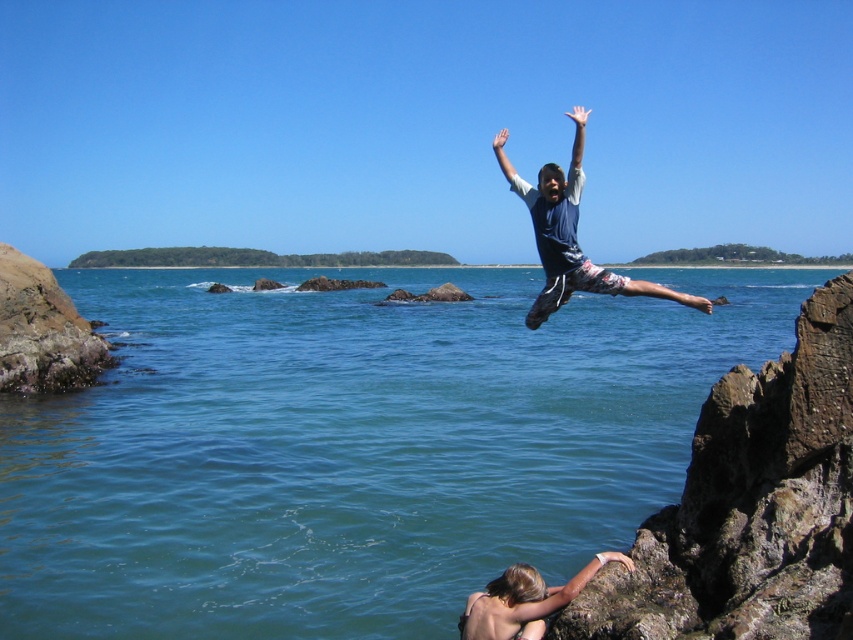
Question: Can you confirm if clear blue water at center is positioned above blue cotton shirt at upper center?

Choices:
 (A) yes
 (B) no

Answer: (B)

Question: Is clear blue water at center to the right of blue cotton shirt at upper center from the viewer's perspective?

Choices:
 (A) no
 (B) yes

Answer: (A)

Question: Which object is closer to the camera taking this photo?

Choices:
 (A) brown rough rock at right
 (B) clear blue water at center
 (C) blonde hair at lower right
 (D) blue cotton shirt at upper center

Answer: (A)

Question: From the image, what is the correct spatial relationship of clear blue water at center in relation to blue cotton shirt at upper center?

Choices:
 (A) above
 (B) below

Answer: (B)

Question: Which of the following is the farthest from the observer?

Choices:
 (A) brown rough rock at right
 (B) blue cotton shirt at upper center
 (C) clear blue water at center

Answer: (B)

Question: Which point is farther from the camera taking this photo?

Choices:
 (A) (532, 570)
 (B) (816, 580)

Answer: (A)